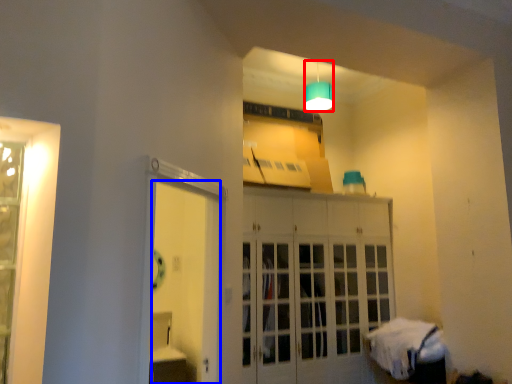
Question: Which point is closer to the camera, lamp (highlighted by a red box) or door (highlighted by a blue box)?

Choices:
 (A) lamp
 (B) door

Answer: (B)